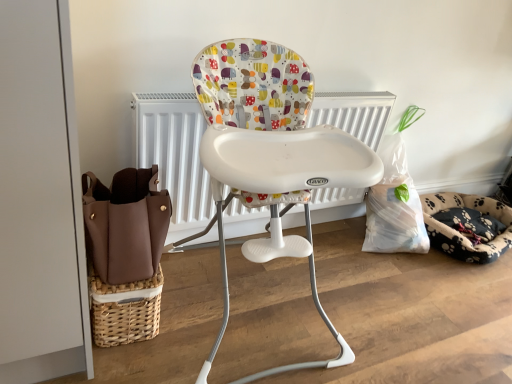
Question: In the image, is white plastic highchair at center on the left side or the right side of fluffy paw-patterned dog bed at right?

Choices:
 (A) right
 (B) left

Answer: (B)

Question: Is white plastic highchair at center in front of or behind fluffy paw-patterned dog bed at right in the image?

Choices:
 (A) behind
 (B) front

Answer: (B)

Question: From the image's perspective, is white plastic highchair at center above or below fluffy paw-patterned dog bed at right?

Choices:
 (A) below
 (B) above

Answer: (B)

Question: In the image, is fluffy paw-patterned dog bed at right positioned in front of or behind white plastic highchair at center?

Choices:
 (A) behind
 (B) front

Answer: (A)

Question: Would you say fluffy paw-patterned dog bed at right is to the left or to the right of white plastic highchair at center in the picture?

Choices:
 (A) left
 (B) right

Answer: (B)

Question: Is point click(436, 203) closer or farther from the camera than point click(282, 162)?

Choices:
 (A) farther
 (B) closer

Answer: (A)

Question: Looking at the image, does fluffy paw-patterned dog bed at right seem bigger or smaller compared to white plastic highchair at center?

Choices:
 (A) big
 (B) small

Answer: (B)